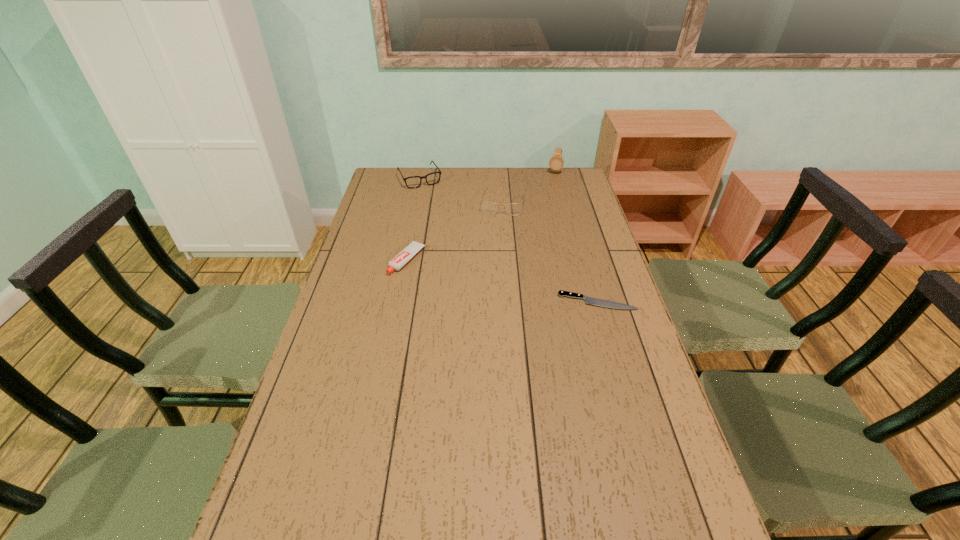
At what (x,y) coordinates should I click in order to perform the action: click on toothpaste that is at the left edge. Please return your answer as a coordinate pair (x, y). The height and width of the screenshot is (540, 960). Looking at the image, I should click on (405, 255).

This screenshot has width=960, height=540. Identify the location of spectacles located in the left edge section of the desktop. (432, 178).

The height and width of the screenshot is (540, 960). Identify the location of steak knife at the right edge. (589, 300).

Where is `watch located at the right edge`? watch located at the right edge is located at coordinates (556, 162).

You are a GUI agent. You are given a task and a screenshot of the screen. Output one action in this format:
    pyautogui.click(x=<x>, y=<y>)
    Task: Click on the object situated at the far left corner
    The height and width of the screenshot is (540, 960).
    Given the screenshot: What is the action you would take?
    pyautogui.click(x=432, y=178)

What are the coordinates of `object that is at the far right corner` in the screenshot? It's located at (556, 162).

Identify the location of vacant space at the far edge. This screenshot has width=960, height=540. (516, 178).

In the image, there is a desktop. Where is `vacant space at the near edge`? vacant space at the near edge is located at coordinates (435, 518).

This screenshot has width=960, height=540. In the image, there is a desktop. Find the location of `vacant space at the left edge`. vacant space at the left edge is located at coordinates (381, 279).

The height and width of the screenshot is (540, 960). Identify the location of free region at the right edge of the desktop. (622, 328).